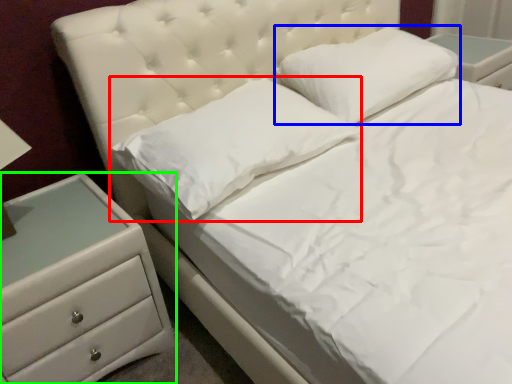
Question: Which object is positioned closest to pillow (highlighted by a red box)? Select from pillow (highlighted by a blue box) and chest of drawers (highlighted by a green box).

Choices:
 (A) pillow
 (B) chest of drawers

Answer: (B)